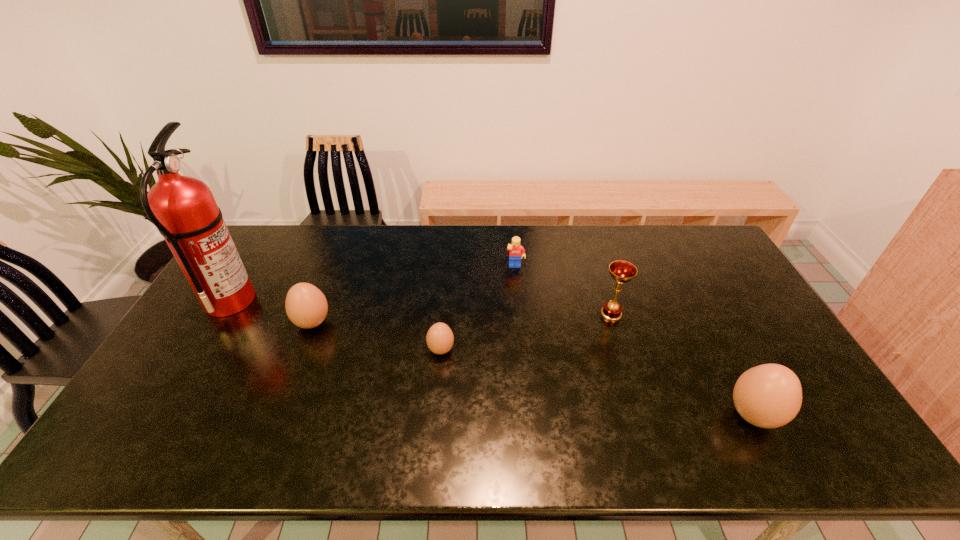
If equal spacing is the goal by inserting an additional boiled_egg among them, please point out a vacant space for this new boiled_egg. Please provide its 2D coordinates. Your answer should be formatted as a tuple, i.e. [(x, y)], where the tuple contains the x and y coordinates of a point satisfying the conditions above.

[(587, 380)]